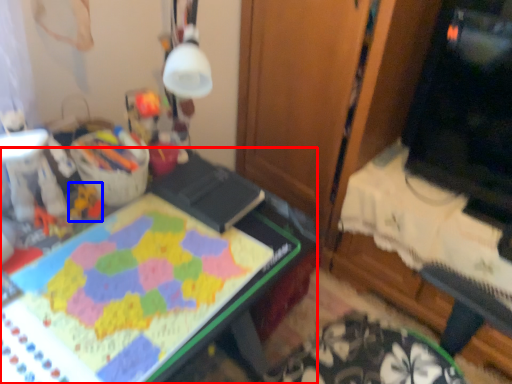
Question: Which point is further to the camera, desk (highlighted by a red box) or toy (highlighted by a blue box)?

Choices:
 (A) desk
 (B) toy

Answer: (B)